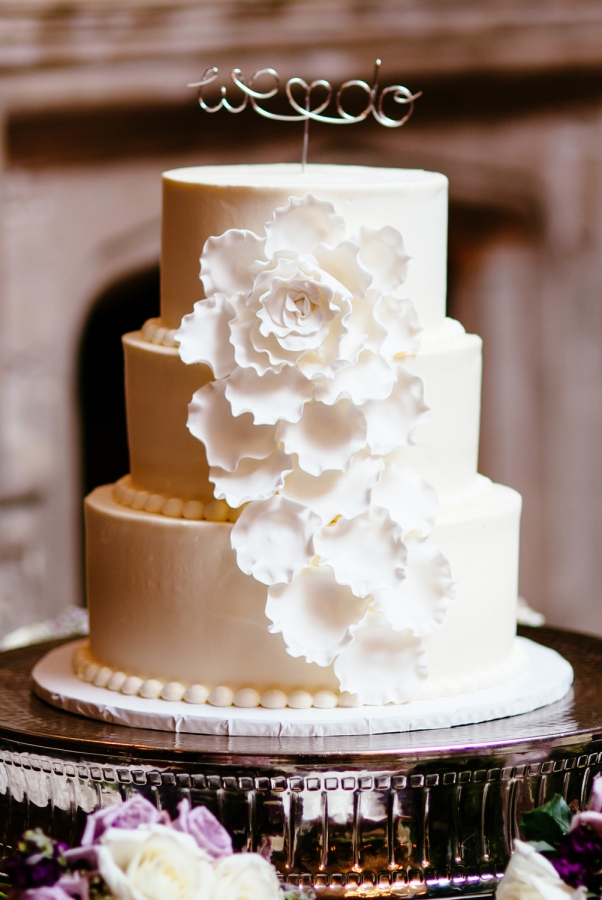
At what (x,y) coordinates should I click in order to perform the action: click on serving trays. Please return your answer as a coordinate pair (x, y). Looking at the image, I should click on (265, 721), (308, 745).